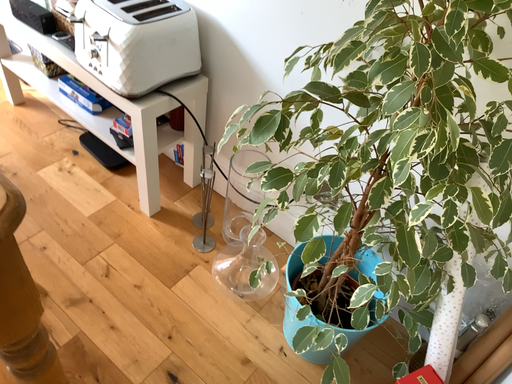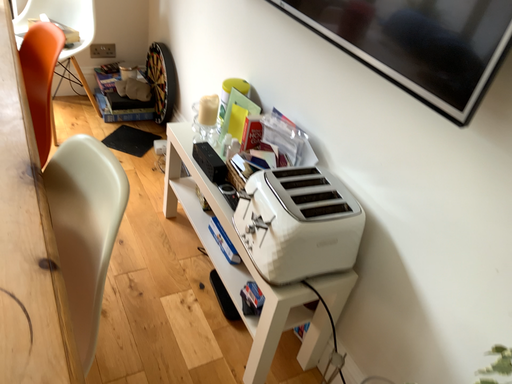
Question: How did the camera likely rotate when shooting the video?

Choices:
 (A) rotated upward
 (B) rotated downward

Answer: (A)